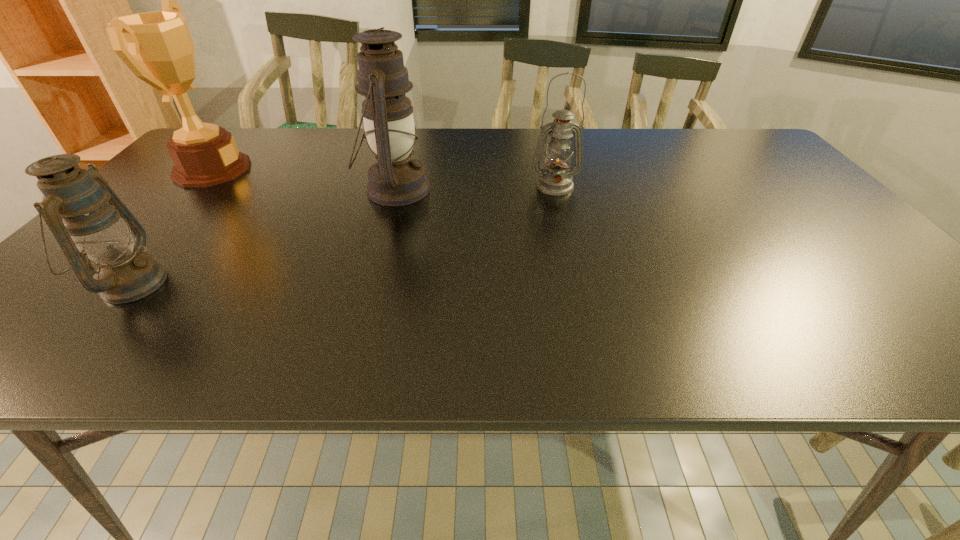
Locate an element on the screen. award is located at coordinates (157, 46).

Image resolution: width=960 pixels, height=540 pixels. What are the coordinates of `the second oil lamp from right to left` in the screenshot? It's located at (395, 179).

I want to click on the tallest oil lamp, so click(x=395, y=179).

Where is `the rightmost oil lamp`? The height and width of the screenshot is (540, 960). the rightmost oil lamp is located at coordinates coord(556,180).

Find the location of a particular element. The width and height of the screenshot is (960, 540). the nearest object is located at coordinates (74, 206).

Locate an element on the screen. the leftmost oil lamp is located at coordinates (74, 206).

At what (x,y) coordinates should I click in order to perform the action: click on vacant space located on the front-facing side of the award. Please return your answer as a coordinate pair (x, y). The image size is (960, 540). Looking at the image, I should click on (273, 170).

Where is `free space located 0.350m on the left of the tallest oil lamp`? free space located 0.350m on the left of the tallest oil lamp is located at coordinates (232, 190).

Where is `vacant space located 0.360m on the front of the rightmost object`? Image resolution: width=960 pixels, height=540 pixels. vacant space located 0.360m on the front of the rightmost object is located at coordinates (x=580, y=288).

The width and height of the screenshot is (960, 540). I want to click on vacant area located on the back of the nearest object, so click(195, 209).